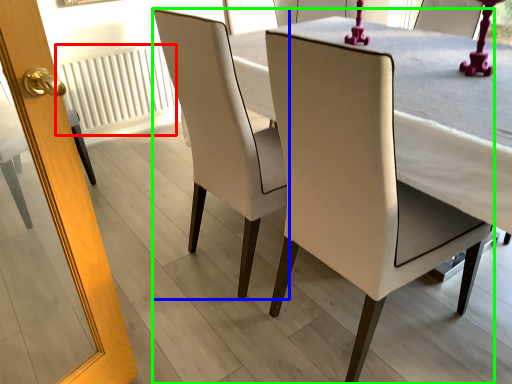
Question: Which object is positioned farthest from radiator (highlighted by a red box)? Select from chair (highlighted by a blue box) and chair (highlighted by a green box).

Choices:
 (A) chair
 (B) chair

Answer: (B)